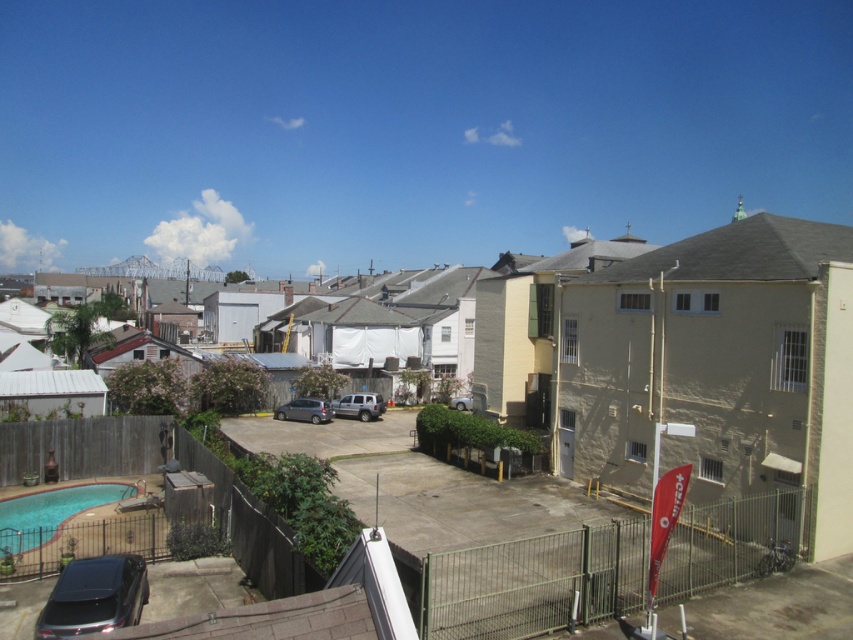
Question: Does matte silver suv at center come behind satin silver van at center?

Choices:
 (A) yes
 (B) no

Answer: (A)

Question: Among these objects, which one is farthest from the camera?

Choices:
 (A) matte silver suv at center
 (B) satin silver van at center

Answer: (A)

Question: Can you confirm if blue smooth pool at lower left is positioned to the right of matte silver suv at center?

Choices:
 (A) no
 (B) yes

Answer: (A)

Question: Which object is the closest to the blue smooth pool at lower left?

Choices:
 (A) shiny black suv at lower left
 (B) satin silver van at center

Answer: (A)

Question: Which point is closer to the camera?

Choices:
 (A) (86, 600)
 (B) (78, 509)
 (C) (318, 420)
 (D) (358, 408)

Answer: (A)

Question: Is matte silver suv at center positioned at the back of satin silver van at center?

Choices:
 (A) yes
 (B) no

Answer: (A)